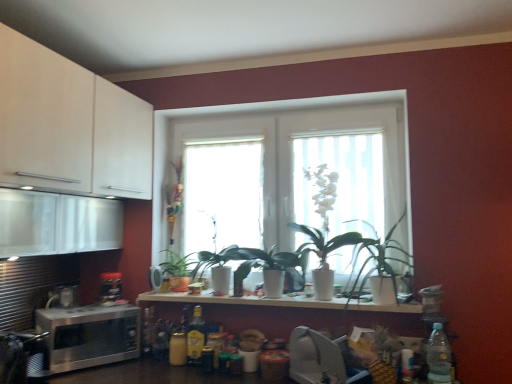
Locate an element on the screen. free spot below white glossy pot at center, which ranks as the first plant in left-to-right order (from a real-world perspective) is located at coordinates (210, 296).